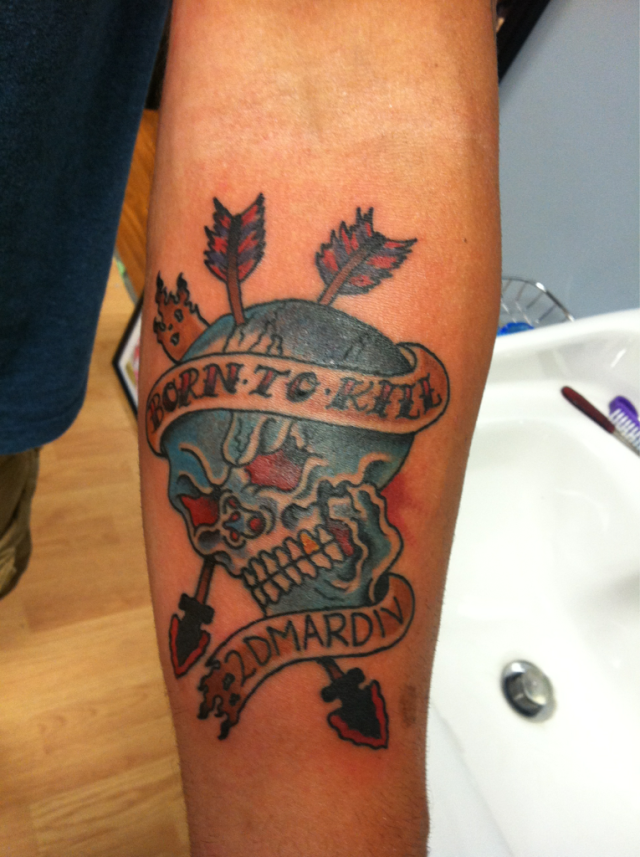
Locate an element on the screen. This screenshot has width=640, height=857. empty space on the wall is located at coordinates (582, 164).